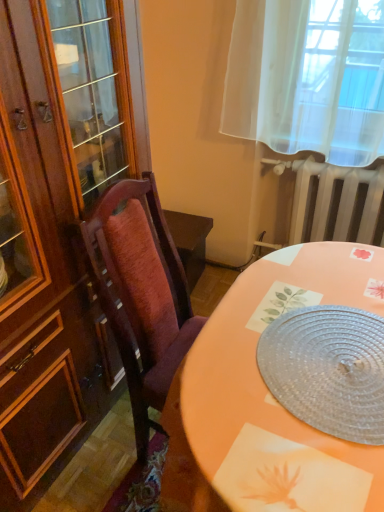
What do you see at coordinates (328, 369) in the screenshot? This screenshot has height=512, width=384. I see `clear plastic placemat at center` at bounding box center [328, 369].

Find the location of a particular element. The image size is (384, 512). clear plastic placemat at center is located at coordinates (328, 369).

Measure the distance between white metallic radiator at upper right and camera.

white metallic radiator at upper right is 1.67 meters away from camera.

What do you see at coordinates (334, 202) in the screenshot? I see `white metallic radiator at upper right` at bounding box center [334, 202].

What is the approximate width of white metallic radiator at upper right?

white metallic radiator at upper right is 7.49 inches wide.

You are a GUI agent. You are given a task and a screenshot of the screen. Output one action in this format:
    pyautogui.click(x=<x>, y=<y>)
    Task: Click on the white metallic radiator at upper right
    This screenshot has height=512, width=384.
    Given the screenshot: What is the action you would take?
    pyautogui.click(x=334, y=202)

Find the location of a particular element. This screenshot has height=512, width=384. clear plastic placemat at center is located at coordinates (328, 369).

Considering the relative positions of white metallic radiator at upper right and clear plastic placemat at center in the image provided, is white metallic radiator at upper right to the left or to the right of clear plastic placemat at center?

Clearly, white metallic radiator at upper right is on the right of clear plastic placemat at center in the image.

Which is in front, white metallic radiator at upper right or clear plastic placemat at center?

Positioned in front is clear plastic placemat at center.

Is point (355, 223) closer or farther from the camera than point (298, 314)?

Point (355, 223).

From the image's perspective, would you say white metallic radiator at upper right is shown under clear plastic placemat at center?

No.

From a real-world perspective, relative to clear plastic placemat at center, is white metallic radiator at upper right vertically above or below?

white metallic radiator at upper right is situated lower than clear plastic placemat at center in the real world.

Does white metallic radiator at upper right have a greater width compared to clear plastic placemat at center?

No.

Which of these two, white metallic radiator at upper right or clear plastic placemat at center, stands shorter?

clear plastic placemat at center is shorter.

Does white metallic radiator at upper right have a larger size compared to clear plastic placemat at center?

Indeed, white metallic radiator at upper right has a larger size compared to clear plastic placemat at center.

Is clear plastic placemat at center a part of white metallic radiator at upper right?

No, white metallic radiator at upper right does not contain clear plastic placemat at center.

Are white metallic radiator at upper right and clear plastic placemat at center far apart?

Yes.

Is white metallic radiator at upper right facing away from clear plastic placemat at center?

white metallic radiator at upper right is not turned away from clear plastic placemat at center.

Image resolution: width=384 pixels, height=512 pixels. What are the coordinates of `platter in front of the white metallic radiator at upper right` in the screenshot? It's located at (328, 369).

Between clear plastic placemat at center and white metallic radiator at upper right, which one appears on the right side from the viewer's perspective?

Positioned to the right is white metallic radiator at upper right.

In the image, is clear plastic placemat at center positioned in front of or behind white metallic radiator at upper right?

clear plastic placemat at center is in front of white metallic radiator at upper right.

Which is more distant, (x=360, y=414) or (x=361, y=207)?

The point (x=361, y=207) is behind.

From the image's perspective, between clear plastic placemat at center and white metallic radiator at upper right, who is located below?

clear plastic placemat at center is shown below in the image.

From a real-world perspective, which is physically above, clear plastic placemat at center or white metallic radiator at upper right?

From a 3D spatial view, clear plastic placemat at center is above.

Based on the photo, is clear plastic placemat at center wider or thinner than white metallic radiator at upper right?

Considering their sizes, clear plastic placemat at center looks broader than white metallic radiator at upper right.

In terms of height, does clear plastic placemat at center look taller or shorter compared to white metallic radiator at upper right?

Clearly, clear plastic placemat at center is shorter compared to white metallic radiator at upper right.

Looking at the image, does clear plastic placemat at center seem bigger or smaller compared to white metallic radiator at upper right?

In the image, clear plastic placemat at center appears to be smaller than white metallic radiator at upper right.

Is clear plastic placemat at center located outside white metallic radiator at upper right?

That's correct, clear plastic placemat at center is outside of white metallic radiator at upper right.

Is clear plastic placemat at center far from white metallic radiator at upper right?

Indeed, clear plastic placemat at center is not near white metallic radiator at upper right.

Is clear plastic placemat at center positioned with its back to white metallic radiator at upper right?

No, clear plastic placemat at center is not facing away from white metallic radiator at upper right.

What's the angular difference between clear plastic placemat at center and white metallic radiator at upper right's facing directions?

clear plastic placemat at center and white metallic radiator at upper right are facing 0.555 degrees away from each other.

Locate an element on the screen. The image size is (384, 512). radiator above the clear plastic placemat at center (from the image's perspective) is located at coordinates [x=334, y=202].

You are a GUI agent. You are given a task and a screenshot of the screen. Output one action in this format:
    pyautogui.click(x=<x>, y=<y>)
    Task: Click on the platter located below the white metallic radiator at upper right (from the image's perspective)
    
    Given the screenshot: What is the action you would take?
    pyautogui.click(x=328, y=369)

This screenshot has width=384, height=512. Find the location of `radiator behind the clear plastic placemat at center`. radiator behind the clear plastic placemat at center is located at coordinates (334, 202).